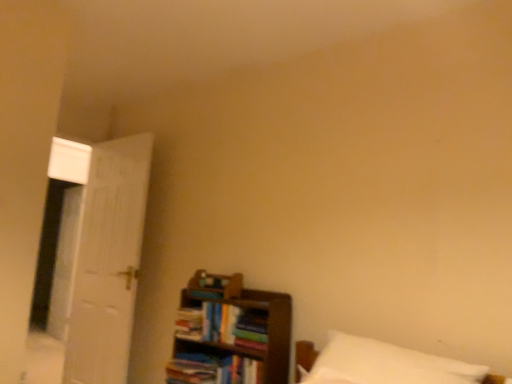
Question: Considering the positions of white soft pillow at lower right and hardcover book at center, positioned as the fourth book in bottom-to-top order, in the image, is white soft pillow at lower right wider or thinner than hardcover book at center, positioned as the fourth book in bottom-to-top order,?

Choices:
 (A) wide
 (B) thin

Answer: (A)

Question: From a real-world perspective, is white soft pillow at lower right positioned above or below hardcover book at center, acting as the first book starting from the top?

Choices:
 (A) below
 (B) above

Answer: (A)

Question: Based on their relative distances, which object is farther from the hardcover book at center, the 2th book positioned from the bottom?

Choices:
 (A) hardcover book at center, acting as the first book starting from the top
 (B) wooden bookshelf at lower right
 (C) white matte door at left
 (D) hardcover book at center, which is the 1th book in bottom-to-top order
 (E) multicolored paper book at center, arranged as the 2th book when viewed from the top

Answer: (C)

Question: Which of these objects is positioned closest to the hardcover book at center, positioned as the fourth book in bottom-to-top order?

Choices:
 (A) white matte door at left
 (B) hardcover book at center, the 2th book positioned from the bottom
 (C) hardcover book at center, which is the 1th book in bottom-to-top order
 (D) wooden bookshelf at lower right
 (E) multicolored paper book at center, which is the third book from bottom to top

Answer: (B)